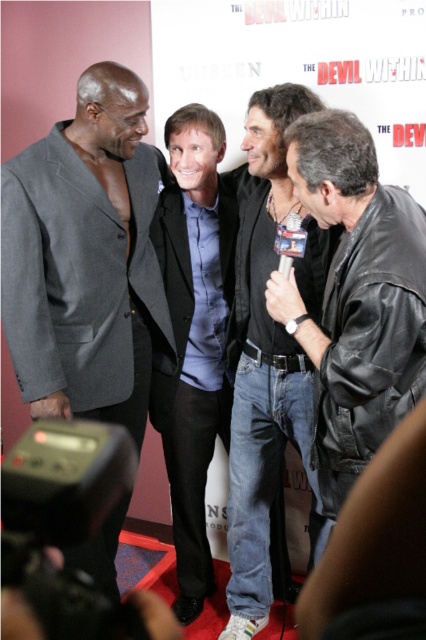
You are at the promotional event for The Devil Within and want to take a photo of the two points mentioned. Which point is closer to you, point (267, 438) or point (187, 557)?

Point (267, 438) is closer to you than point (187, 557).

In the scene shown: You are a photographer at the event and need to adjust the lighting to ensure both the jeans at center and the matte black suit at center are well lit. Which item should you focus on first to ensure proper exposure, considering their positions?

The jeans at center is located below the matte black suit at center. Since the jeans are lower, they might be in shadow if the main light is above, so focus on the jeans first to balance exposure.